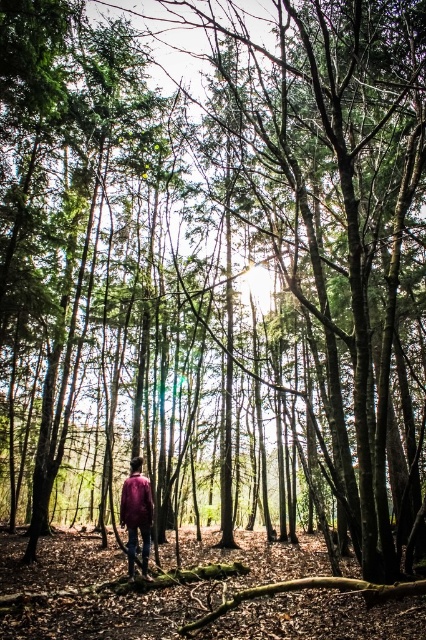
Who is more distant from viewer, (144, 509) or (126, 490)?

Positioned behind is point (126, 490).

The height and width of the screenshot is (640, 426). Describe the element at coordinates (137, 513) in the screenshot. I see `matte purple shirt at center` at that location.

The height and width of the screenshot is (640, 426). Find the location of `matte purple shirt at center`. matte purple shirt at center is located at coordinates (137, 513).